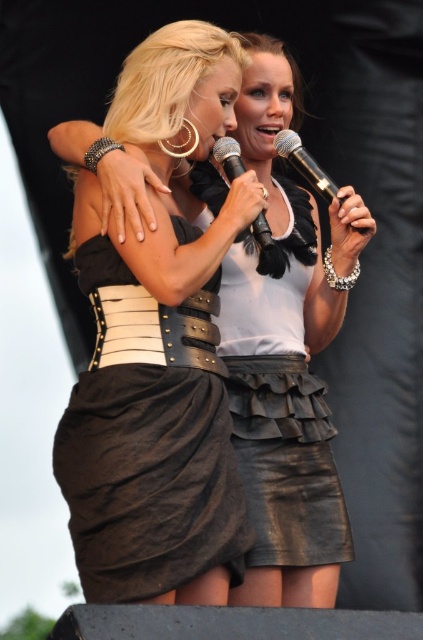
Question: Where is black leather skirt at center located in relation to black matte microphone at center in the image?

Choices:
 (A) right
 (B) left

Answer: (B)

Question: Is brown leather skirt at center below metallic silver microphone at center?

Choices:
 (A) no
 (B) yes

Answer: (B)

Question: Which is farther from the metallic silver microphone at center?

Choices:
 (A) black matte microphone at center
 (B) black leather skirt at center
 (C) brown leather skirt at center
 (D) leather skirt at center

Answer: (C)

Question: Which of the following is the farthest from the observer?

Choices:
 (A) (266, 417)
 (B) (296, 579)

Answer: (A)

Question: Is black leather skirt at center wider than brown leather skirt at center?

Choices:
 (A) yes
 (B) no

Answer: (A)

Question: Which object is the farthest from the leather skirt at center?

Choices:
 (A) black leather skirt at center
 (B) brown leather skirt at center

Answer: (B)